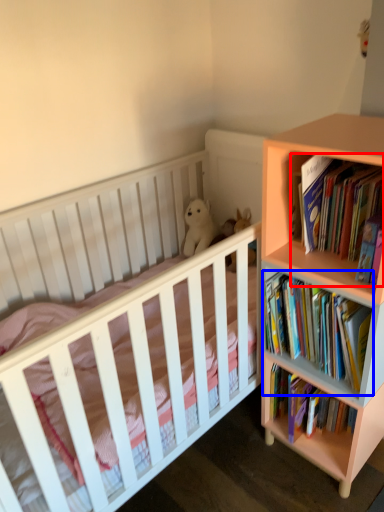
Question: Which point is further to the camera, book (highlighted by a red box) or book (highlighted by a blue box)?

Choices:
 (A) book
 (B) book

Answer: (B)